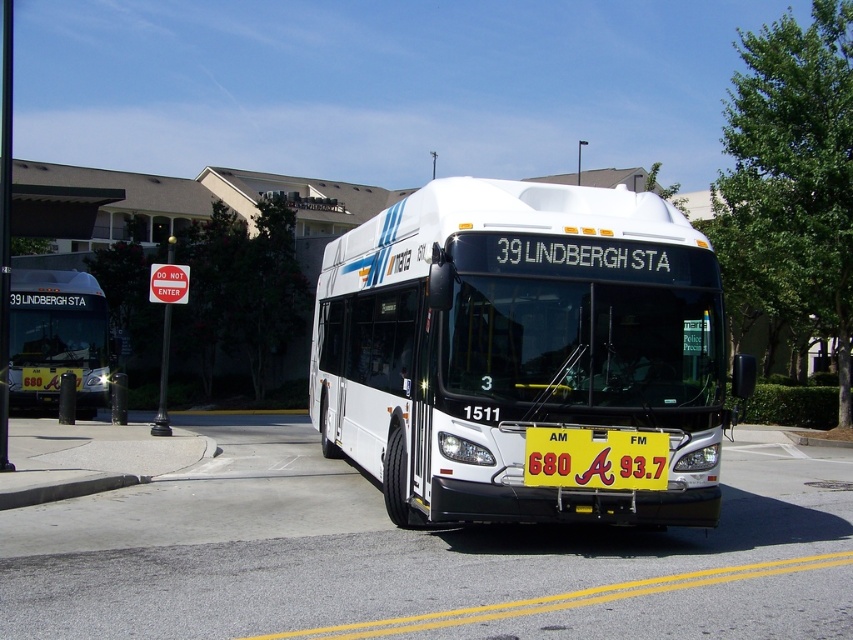
Is white glossy bus at center bigger than yellow plastic sign at center?

Incorrect, white glossy bus at center is not larger than yellow plastic sign at center.

Is white glossy bus at center to the left of yellow plastic sign at center from the viewer's perspective?

No, white glossy bus at center is not to the left of yellow plastic sign at center.

Locate an element on the screen. This screenshot has width=853, height=640. white glossy bus at center is located at coordinates (524, 356).

This screenshot has width=853, height=640. Identify the location of white glossy bus at center. (524, 356).

Between point (454, 193) and point (48, 397), which one is positioned behind?

The point (48, 397) is behind.

Identify the location of white glossy bus at center. This screenshot has height=640, width=853. (524, 356).

Does point (573, 454) come farther from viewer compared to point (106, 336)?

No, (573, 454) is in front of (106, 336).

Locate an element on the screen. This screenshot has width=853, height=640. white glossy bus at center is located at coordinates (524, 356).

Which is below, white matte bus at center or yellow plastic sign at center?

yellow plastic sign at center is below.

Is point (106, 333) positioned behind point (573, 435)?

That is True.

At what (x,y) coordinates should I click in order to perform the action: click on white matte bus at center. Please return your answer as a coordinate pair (x, y). This screenshot has height=640, width=853. Looking at the image, I should click on (57, 339).